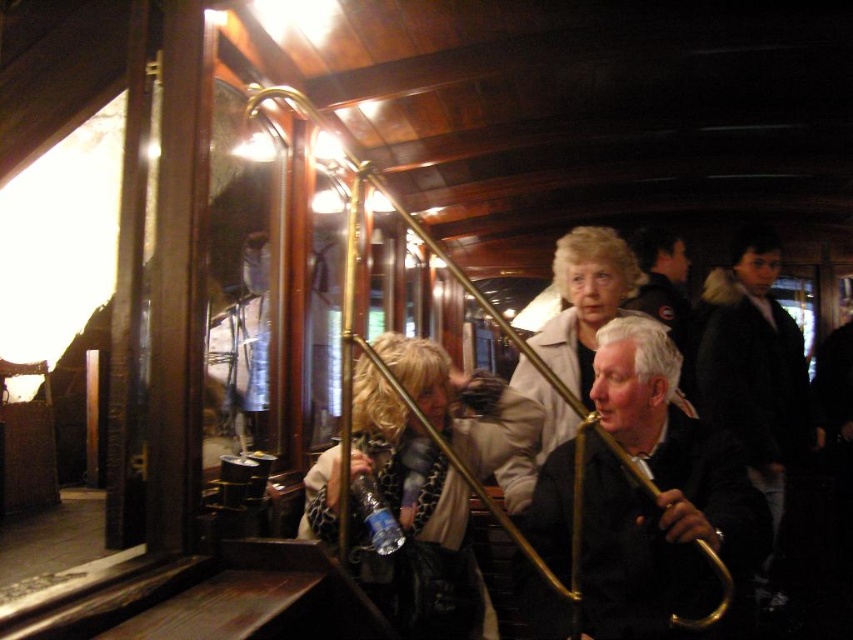
You are a photographer trying to capture a closeup of the leopard print scarf at center and the white textured coat at center. Since you want both items to be clearly visible in the frame, which one should you zoom in on more?

The leopard print scarf at center is smaller than the white textured coat at center, so you should zoom in more on the leopard print scarf at center to ensure it appears large enough in the photo compared to the coat.

You are a photographer trying to capture a candid shot of two people wearing coats in the vintage tram. The black leather jacket at center and the white textured coat at center are both in your frame. Since you want to ensure the jackets are clearly visible, which coat should you focus on to account for their sizes?

The black leather jacket at center is wider than the white textured coat at center, so focusing on the black leather jacket at center would ensure it is clearly visible due to its larger size.